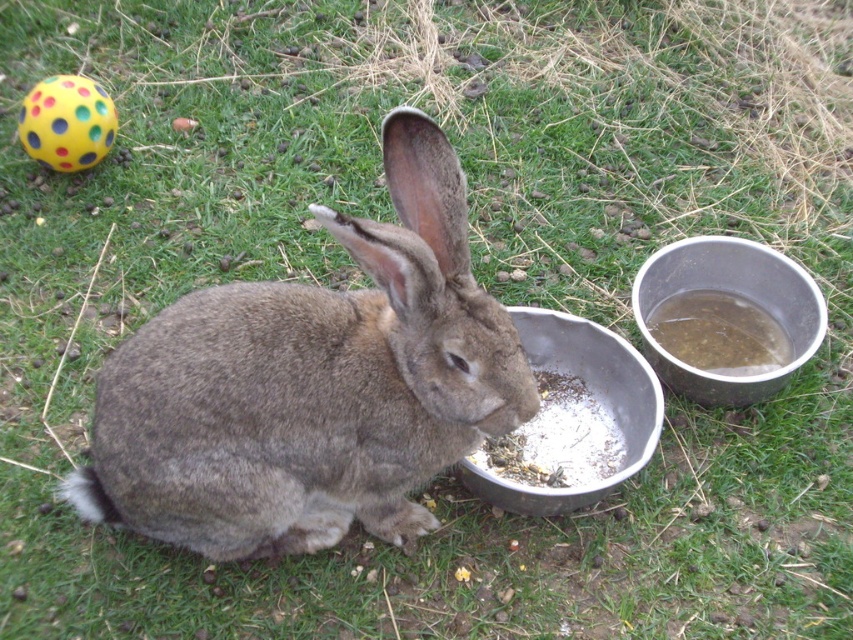
Which of these two, fuzzy gray rabbit at center or white powder at lower center, stands shorter?

white powder at lower center

Which is behind, point (248, 380) or point (558, 380)?

The point (558, 380) is more distant.

Is point (399, 124) positioned behind point (589, 449)?

No, it is not.

Locate an element on the screen. This screenshot has width=853, height=640. fuzzy gray rabbit at center is located at coordinates (312, 385).

Who is more distant from viewer, (297, 320) or (660, 365)?

The point (660, 365) is more distant.

Does fuzzy gray rabbit at center have a lesser width compared to metallic silver bowl at right?

No, fuzzy gray rabbit at center is not thinner than metallic silver bowl at right.

You are a GUI agent. You are given a task and a screenshot of the screen. Output one action in this format:
    pyautogui.click(x=<x>, y=<y>)
    Task: Click on the fuzzy gray rabbit at center
    
    Given the screenshot: What is the action you would take?
    pyautogui.click(x=312, y=385)

Can you confirm if fuzzy gray rabbit at center is positioned above translucent plastic water at right?

No, fuzzy gray rabbit at center is not above translucent plastic water at right.

Which is below, fuzzy gray rabbit at center or translucent plastic water at right?

fuzzy gray rabbit at center is below.

At what (x,y) coordinates should I click in order to perform the action: click on fuzzy gray rabbit at center. Please return your answer as a coordinate pair (x, y). The width and height of the screenshot is (853, 640). Looking at the image, I should click on (312, 385).